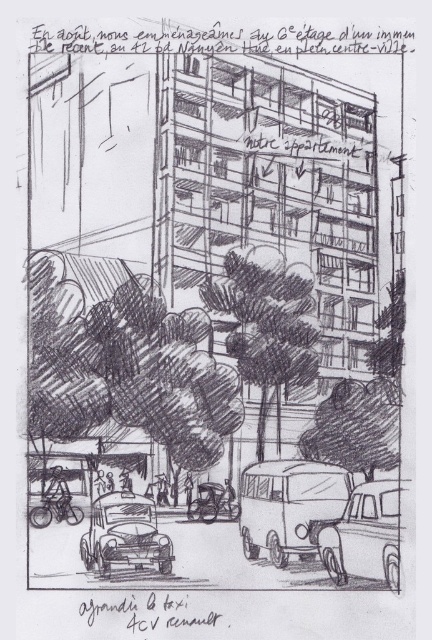
Question: Estimate the real-world distances between objects in this image. Which object is farther from the charcoal textured tree at center?

Choices:
 (A) matte black taxi at lower left
 (B) metallic silver car at center
 (C) shiny silver sedan at center
 (D) matte gray van at center

Answer: (C)

Question: Which object is closer to the camera taking this photo?

Choices:
 (A) matte black taxi at lower left
 (B) metallic silver car at center
 (C) green textured tree at center
 (D) charcoal textured tree at center

Answer: (A)

Question: Does matte black taxi at lower left appear over metallic silver car at center?

Choices:
 (A) yes
 (B) no

Answer: (A)

Question: Is shiny silver sedan at center above metallic silver car at center?

Choices:
 (A) no
 (B) yes

Answer: (B)

Question: Estimate the real-world distances between objects in this image. Which object is closer to the green textured tree at center?

Choices:
 (A) matte gray van at center
 (B) shiny silver sedan at center
 (C) charcoal textured tree at center

Answer: (C)

Question: Is charcoal textured tree at center closer to the viewer compared to metallic silver car at center?

Choices:
 (A) yes
 (B) no

Answer: (B)